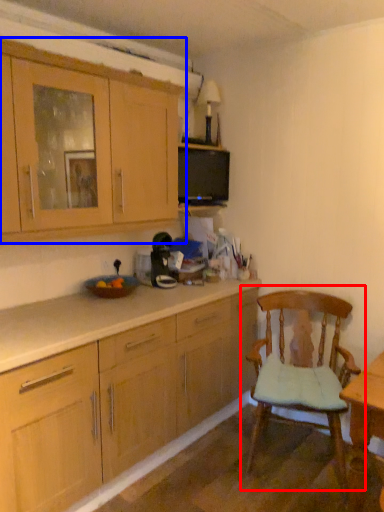
Question: Which of the following is the closest to the observer, chair (highlighted by a red box) or cabinetry (highlighted by a blue box)?

Choices:
 (A) chair
 (B) cabinetry

Answer: (B)